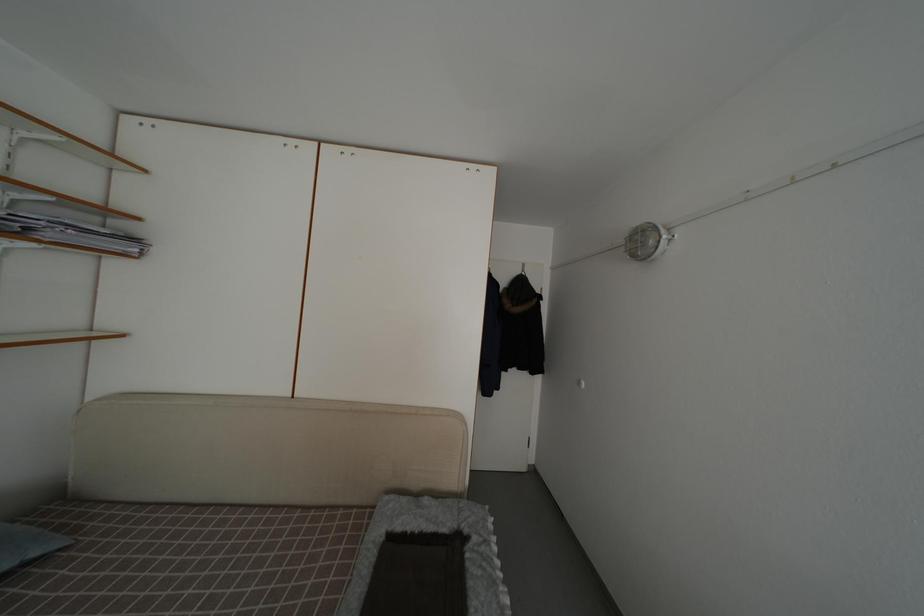
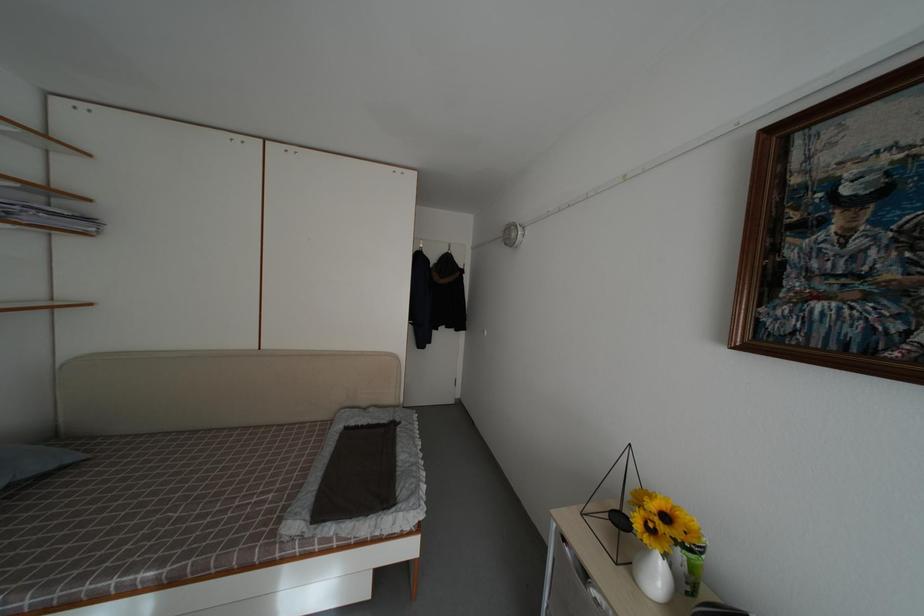
Where in the second image is the point corresponding to [432,507] from the first image?

(378, 416)